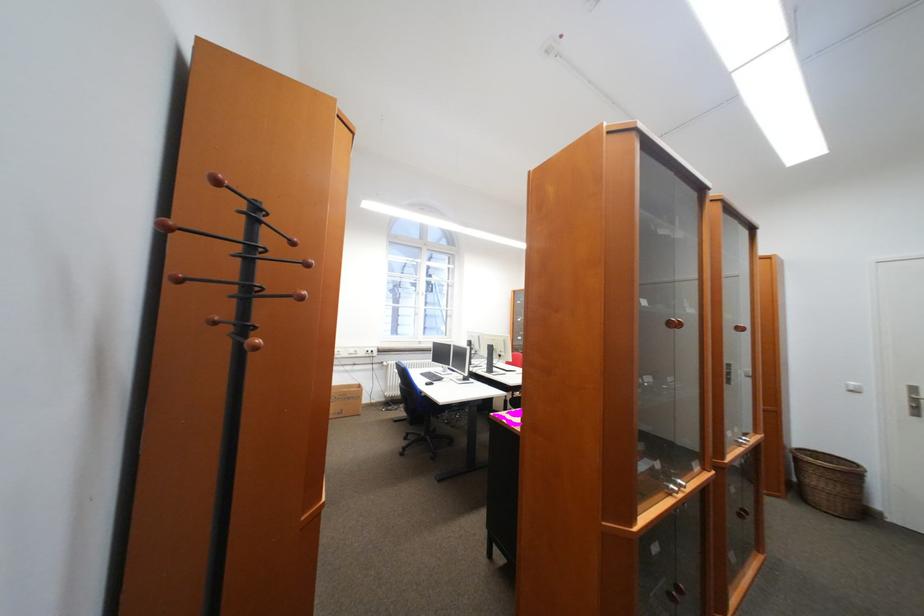
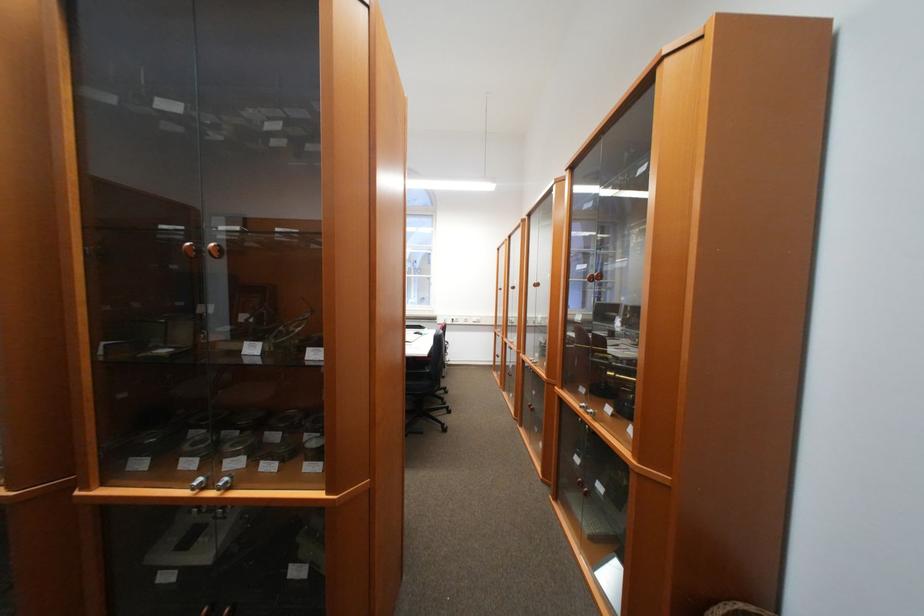
What movement of the cameraman would produce the second image?

The cameraman walked toward right, forward.